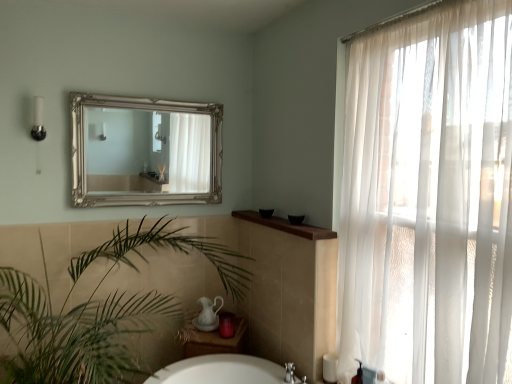
Question: Is the depth of green leafy plant at lower left greater than that of sheer white curtain at right?

Choices:
 (A) no
 (B) yes

Answer: (B)

Question: From a real-world perspective, is green leafy plant at lower left over sheer white curtain at right?

Choices:
 (A) yes
 (B) no

Answer: (B)

Question: Does green leafy plant at lower left touch sheer white curtain at right?

Choices:
 (A) no
 (B) yes

Answer: (A)

Question: Would you consider green leafy plant at lower left to be distant from sheer white curtain at right?

Choices:
 (A) no
 (B) yes

Answer: (B)

Question: Is green leafy plant at lower left not within sheer white curtain at right?

Choices:
 (A) no
 (B) yes

Answer: (B)

Question: Can you confirm if green leafy plant at lower left is bigger than sheer white curtain at right?

Choices:
 (A) no
 (B) yes

Answer: (B)

Question: Is black plastic soap dispenser at lower right not within sheer white curtain at right?

Choices:
 (A) no
 (B) yes

Answer: (A)

Question: From the image's perspective, is black plastic soap dispenser at lower right below sheer white curtain at right?

Choices:
 (A) yes
 (B) no

Answer: (A)

Question: From a real-world perspective, is black plastic soap dispenser at lower right beneath sheer white curtain at right?

Choices:
 (A) yes
 (B) no

Answer: (A)

Question: Is black plastic soap dispenser at lower right to the right of sheer white curtain at right from the viewer's perspective?

Choices:
 (A) no
 (B) yes

Answer: (A)

Question: Is black plastic soap dispenser at lower right not close to sheer white curtain at right?

Choices:
 (A) no
 (B) yes

Answer: (A)

Question: Is black plastic soap dispenser at lower right positioned with its back to sheer white curtain at right?

Choices:
 (A) yes
 (B) no

Answer: (A)

Question: Is silver ornate mirror at upper center not inside sheer white curtain at right?

Choices:
 (A) no
 (B) yes

Answer: (B)